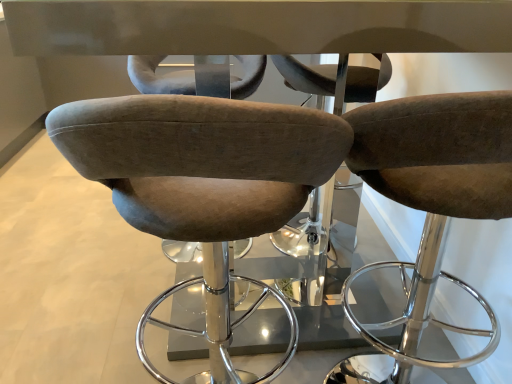
The width and height of the screenshot is (512, 384). Identify the location of velvet brown stool at center, the 1th chair in the left-to-right sequence. (201, 179).

The image size is (512, 384). What do you see at coordinates (201, 179) in the screenshot? I see `velvet brown stool at center, which is the 2th chair from right to left` at bounding box center [201, 179].

Identify the location of suede-like brown stool at center, which appears as the 1th chair when viewed from the right. This screenshot has width=512, height=384. (434, 194).

Describe the element at coordinates (434, 194) in the screenshot. I see `suede-like brown stool at center, positioned as the 2th chair in left-to-right order` at that location.

Find the location of a particular element. This screenshot has height=384, width=512. velvet brown stool at center, which is the 2th chair from right to left is located at coordinates (201, 179).

Visually, is velvet brown stool at center, the 1th chair in the left-to-right sequence, positioned to the left or to the right of suede-like brown stool at center, positioned as the 2th chair in left-to-right order?

In the image, velvet brown stool at center, the 1th chair in the left-to-right sequence, appears on the left side of suede-like brown stool at center, positioned as the 2th chair in left-to-right order.

Considering their positions, is velvet brown stool at center, which is the 2th chair from right to left, located in front of or behind suede-like brown stool at center, positioned as the 2th chair in left-to-right order?

velvet brown stool at center, which is the 2th chair from right to left, is positioned closer to the viewer than suede-like brown stool at center, positioned as the 2th chair in left-to-right order.

Considering the points (251, 106) and (494, 319), which point is behind, point (251, 106) or point (494, 319)?

The point (494, 319) is farther.

From the image's perspective, is velvet brown stool at center, the 1th chair in the left-to-right sequence, above or below suede-like brown stool at center, which appears as the 1th chair when viewed from the right?

velvet brown stool at center, the 1th chair in the left-to-right sequence, is situated lower than suede-like brown stool at center, which appears as the 1th chair when viewed from the right, in the image.

From a real-world perspective, between velvet brown stool at center, the 1th chair in the left-to-right sequence, and suede-like brown stool at center, which appears as the 1th chair when viewed from the right, who is vertically lower?

From a 3D spatial view, suede-like brown stool at center, which appears as the 1th chair when viewed from the right, is below.

Is velvet brown stool at center, the 1th chair in the left-to-right sequence, wider than suede-like brown stool at center, which appears as the 1th chair when viewed from the right?

In fact, velvet brown stool at center, the 1th chair in the left-to-right sequence, might be narrower than suede-like brown stool at center, which appears as the 1th chair when viewed from the right.

Is velvet brown stool at center, the 1th chair in the left-to-right sequence, shorter than suede-like brown stool at center, which appears as the 1th chair when viewed from the right?

Yes, velvet brown stool at center, the 1th chair in the left-to-right sequence, is shorter than suede-like brown stool at center, which appears as the 1th chair when viewed from the right.

Considering the sizes of objects velvet brown stool at center, which is the 2th chair from right to left, and suede-like brown stool at center, which appears as the 1th chair when viewed from the right, in the image provided, who is smaller, velvet brown stool at center, which is the 2th chair from right to left, or suede-like brown stool at center, which appears as the 1th chair when viewed from the right,?

Smaller between the two is suede-like brown stool at center, which appears as the 1th chair when viewed from the right.

Which is correct: velvet brown stool at center, the 1th chair in the left-to-right sequence, is inside suede-like brown stool at center, which appears as the 1th chair when viewed from the right, or outside of it?

velvet brown stool at center, the 1th chair in the left-to-right sequence, lies outside suede-like brown stool at center, which appears as the 1th chair when viewed from the right.

Is velvet brown stool at center, the 1th chair in the left-to-right sequence, in contact with suede-like brown stool at center, which appears as the 1th chair when viewed from the right?

velvet brown stool at center, the 1th chair in the left-to-right sequence, and suede-like brown stool at center, which appears as the 1th chair when viewed from the right, are not in contact.

From the picture: Could you tell me if velvet brown stool at center, the 1th chair in the left-to-right sequence, is turned towards suede-like brown stool at center, which appears as the 1th chair when viewed from the right?

No.

What's the angular difference between velvet brown stool at center, which is the 2th chair from right to left, and suede-like brown stool at center, positioned as the 2th chair in left-to-right order,'s facing directions?

velvet brown stool at center, which is the 2th chair from right to left, and suede-like brown stool at center, positioned as the 2th chair in left-to-right order, are facing 7.95e-05 degrees away from each other.

I want to click on chair located on the left of suede-like brown stool at center, which appears as the 1th chair when viewed from the right, so click(x=201, y=179).

Consider the image. Does suede-like brown stool at center, positioned as the 2th chair in left-to-right order, appear on the right side of velvet brown stool at center, the 1th chair in the left-to-right sequence?

Yes.

Which is behind, suede-like brown stool at center, positioned as the 2th chair in left-to-right order, or velvet brown stool at center, which is the 2th chair from right to left?

Positioned behind is suede-like brown stool at center, positioned as the 2th chair in left-to-right order.

Is point (396, 184) positioned in front of point (114, 147)?

That is False.

From the image's perspective, which is above, suede-like brown stool at center, which appears as the 1th chair when viewed from the right, or velvet brown stool at center, which is the 2th chair from right to left?

suede-like brown stool at center, which appears as the 1th chair when viewed from the right, appears higher in the image.

From a real-world perspective, relative to velvet brown stool at center, the 1th chair in the left-to-right sequence, is suede-like brown stool at center, positioned as the 2th chair in left-to-right order, vertically above or below?

From a real-world perspective, suede-like brown stool at center, positioned as the 2th chair in left-to-right order, is physically below velvet brown stool at center, the 1th chair in the left-to-right sequence.

Considering the relative sizes of suede-like brown stool at center, positioned as the 2th chair in left-to-right order, and velvet brown stool at center, the 1th chair in the left-to-right sequence, in the image provided, is suede-like brown stool at center, positioned as the 2th chair in left-to-right order, wider than velvet brown stool at center, the 1th chair in the left-to-right sequence,?

Correct, the width of suede-like brown stool at center, positioned as the 2th chair in left-to-right order, exceeds that of velvet brown stool at center, the 1th chair in the left-to-right sequence.

Is suede-like brown stool at center, positioned as the 2th chair in left-to-right order, taller or shorter than velvet brown stool at center, which is the 2th chair from right to left?

Considering their sizes, suede-like brown stool at center, positioned as the 2th chair in left-to-right order, has more height than velvet brown stool at center, which is the 2th chair from right to left.

Considering the sizes of objects suede-like brown stool at center, positioned as the 2th chair in left-to-right order, and velvet brown stool at center, the 1th chair in the left-to-right sequence, in the image provided, who is bigger, suede-like brown stool at center, positioned as the 2th chair in left-to-right order, or velvet brown stool at center, the 1th chair in the left-to-right sequence,?

Bigger between the two is velvet brown stool at center, the 1th chair in the left-to-right sequence.

Can velvet brown stool at center, the 1th chair in the left-to-right sequence, be found inside suede-like brown stool at center, which appears as the 1th chair when viewed from the right?

No, velvet brown stool at center, the 1th chair in the left-to-right sequence, is not surrounded by suede-like brown stool at center, which appears as the 1th chair when viewed from the right.

Is there a large distance between suede-like brown stool at center, which appears as the 1th chair when viewed from the right, and velvet brown stool at center, the 1th chair in the left-to-right sequence?

They are positioned close to each other.

Does suede-like brown stool at center, which appears as the 1th chair when viewed from the right, turn towards velvet brown stool at center, the 1th chair in the left-to-right sequence?

No, suede-like brown stool at center, which appears as the 1th chair when viewed from the right, is not turned towards velvet brown stool at center, the 1th chair in the left-to-right sequence.

How different are the orientations of suede-like brown stool at center, which appears as the 1th chair when viewed from the right, and velvet brown stool at center, which is the 2th chair from right to left, in degrees?

They differ by 7.95e-05 degrees in their facing directions.

The height and width of the screenshot is (384, 512). What are the coordinates of `chair to the right of velvet brown stool at center, which is the 2th chair from right to left` in the screenshot? It's located at (434, 194).

This screenshot has width=512, height=384. What are the coordinates of `chair positioned vertically above the suede-like brown stool at center, positioned as the 2th chair in left-to-right order (from a real-world perspective)` in the screenshot? It's located at (201, 179).

This screenshot has height=384, width=512. Identify the location of chair behind the velvet brown stool at center, the 1th chair in the left-to-right sequence. (434, 194).